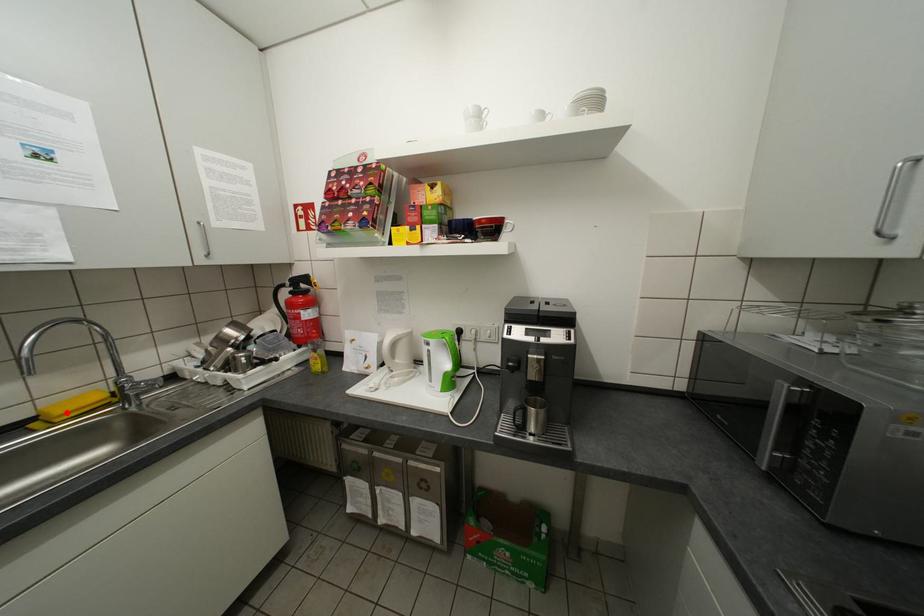
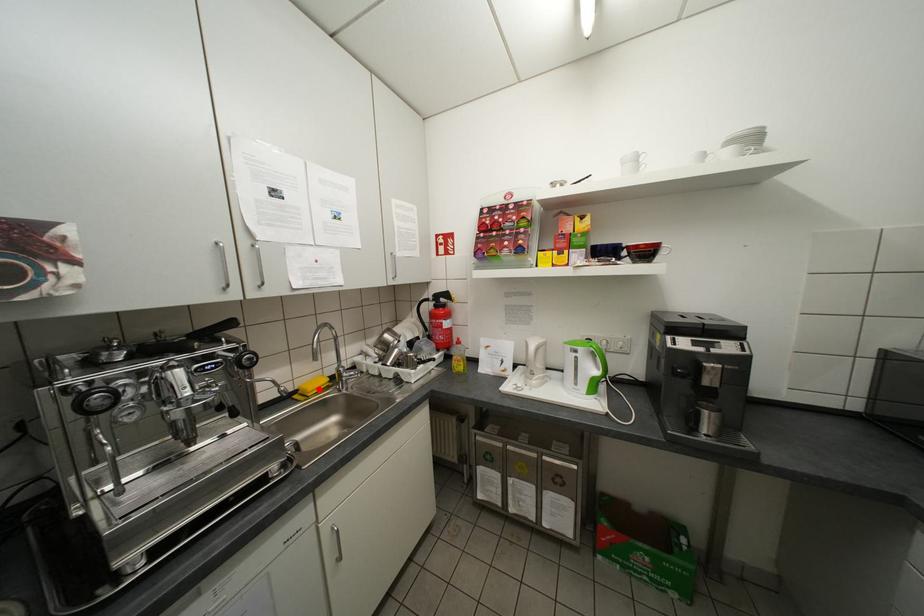
I am providing you with two images of the same scene from different viewpoints. A red point is marked on the first image and another point is marked on the second image. Does the point marked in image1 correspond to the same location as the one in image2?

Yes